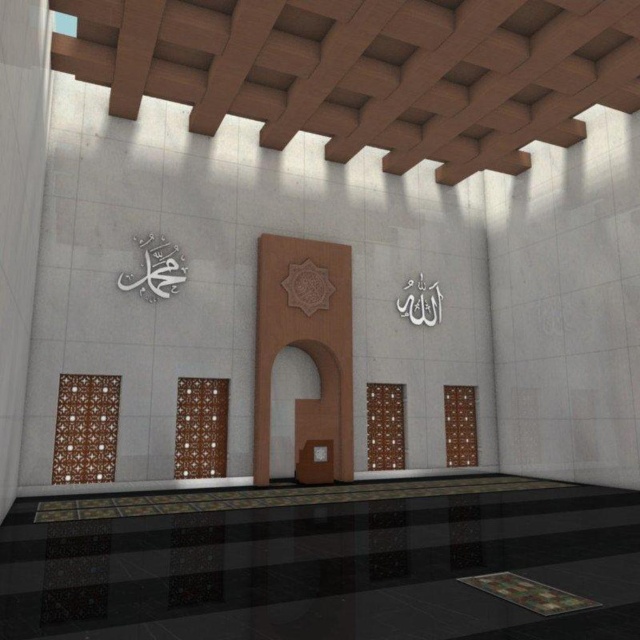
Question: Does brown wooden archway at center appear on the right side of white paper at upper right?

Choices:
 (A) no
 (B) yes

Answer: (A)

Question: Which point is farther to the camera?

Choices:
 (A) (433, 289)
 (B) (160, 266)
 (C) (285, 396)
 (D) (285, 285)

Answer: (A)

Question: Estimate the real-world distances between objects in this image. Which object is farther from the brown wooden archway at center?

Choices:
 (A) brown textured tile at center
 (B) white metallic calligraphy at upper left
 (C) white paper at upper right

Answer: (B)

Question: Is the position of brown wooden archway at center more distant than that of white metallic calligraphy at upper left?

Choices:
 (A) yes
 (B) no

Answer: (A)

Question: Which object is farther from the camera taking this photo?

Choices:
 (A) white metallic calligraphy at upper left
 (B) brown textured tile at center
 (C) brown wooden archway at center

Answer: (C)

Question: Is white metallic calligraphy at upper left bigger than brown textured tile at center?

Choices:
 (A) yes
 (B) no

Answer: (A)